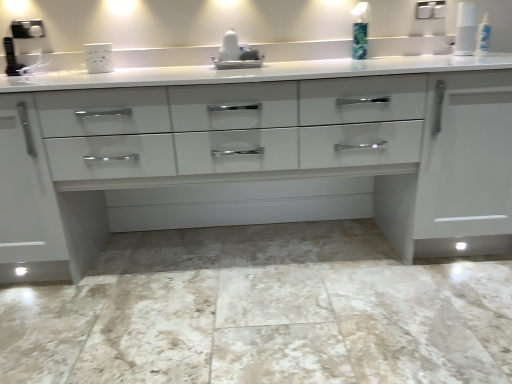
Locate an element on the screen. The image size is (512, 384). free area below white glossy chest of drawers at center (from a real-world perspective) is located at coordinates (190, 256).